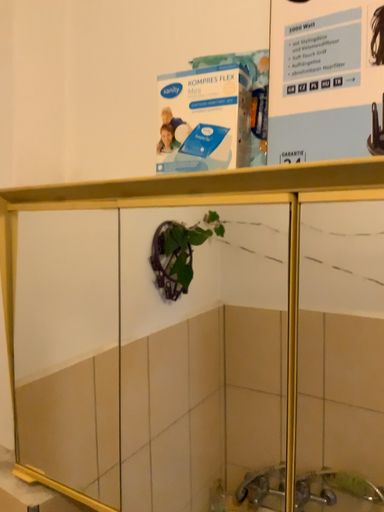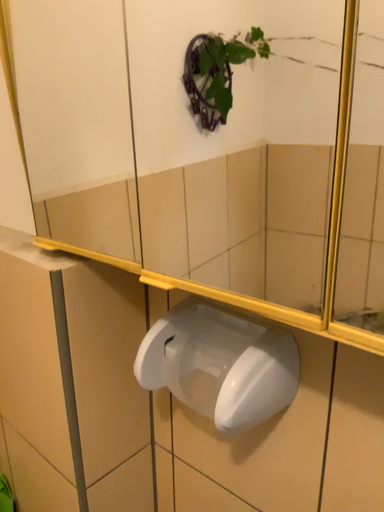
Question: How did the camera likely rotate when shooting the video?

Choices:
 (A) rotated upward
 (B) rotated downward

Answer: (B)